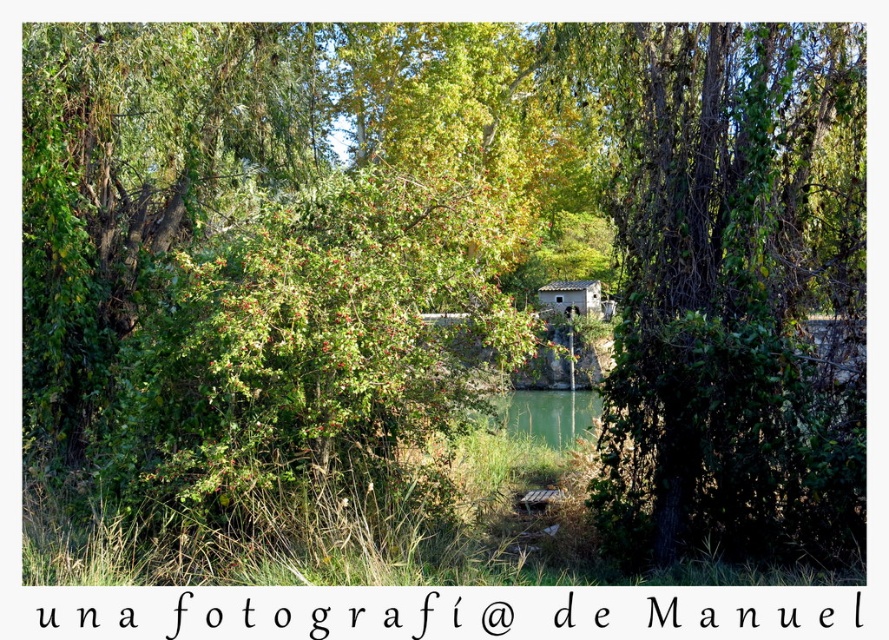
Question: Does green leafy tree at center come behind rustic stone hut at center?

Choices:
 (A) yes
 (B) no

Answer: (B)

Question: Which object appears closest to the camera in this image?

Choices:
 (A) rustic stone hut at center
 (B) green leafy tree at center

Answer: (B)

Question: Can you confirm if green leafy tree at center is positioned to the right of rustic stone hut at center?

Choices:
 (A) yes
 (B) no

Answer: (B)

Question: Does green leafy tree at center have a larger size compared to rustic stone hut at center?

Choices:
 (A) no
 (B) yes

Answer: (B)